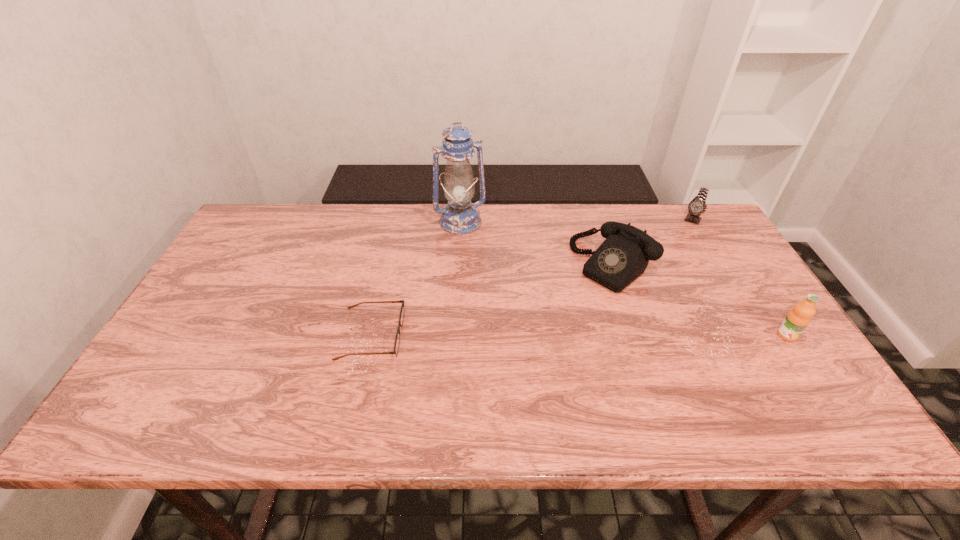
Find the location of a particular element. vacant space at the far right corner is located at coordinates (678, 244).

At what (x,y) coordinates should I click in order to perform the action: click on empty space between the tallest object and the shortest object. Please return your answer as a coordinate pair (x, y). Looking at the image, I should click on (416, 278).

Where is `free spot between the leftmost object and the lantern`? The width and height of the screenshot is (960, 540). free spot between the leftmost object and the lantern is located at coordinates (416, 278).

You are a GUI agent. You are given a task and a screenshot of the screen. Output one action in this format:
    pyautogui.click(x=<x>, y=<y>)
    Task: Click on the free area in between the lantern and the watch
    
    Given the screenshot: What is the action you would take?
    pyautogui.click(x=576, y=221)

This screenshot has height=540, width=960. Find the location of `vacant area between the tallest object and the third nearest object`. vacant area between the tallest object and the third nearest object is located at coordinates (537, 243).

Identify the location of unoccupied area between the lantern and the leftmost object. The height and width of the screenshot is (540, 960). (416, 278).

The width and height of the screenshot is (960, 540). In order to click on empty location between the watch and the spectacles in this screenshot , I will do `click(532, 277)`.

Choose which object is the fourth nearest neighbor to the watch. Please provide its 2D coordinates. Your answer should be formatted as a tuple, i.e. [(x, y)], where the tuple contains the x and y coordinates of a point satisfying the conditions above.

[(397, 340)]

Locate an element on the screen. Image resolution: width=960 pixels, height=540 pixels. the second closest object to the leftmost object is located at coordinates (624, 255).

Locate an element on the screen. free space that satisfies the following two spatial constraints: 1. on the back side of the second object from right to left; 2. on the right side of the second object from left to right is located at coordinates point(461,220).